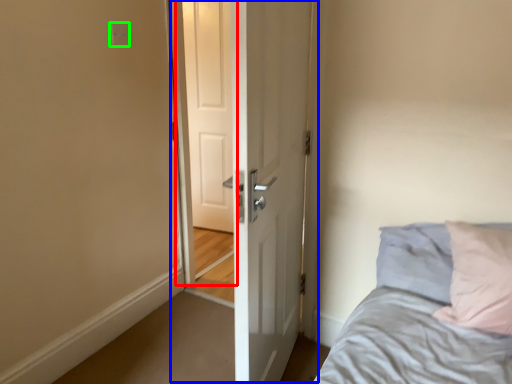
Question: Which object is positioned farthest from screen door (highlighted by a red box)? Select from door (highlighted by a blue box) and electric outlet (highlighted by a green box).

Choices:
 (A) door
 (B) electric outlet

Answer: (A)